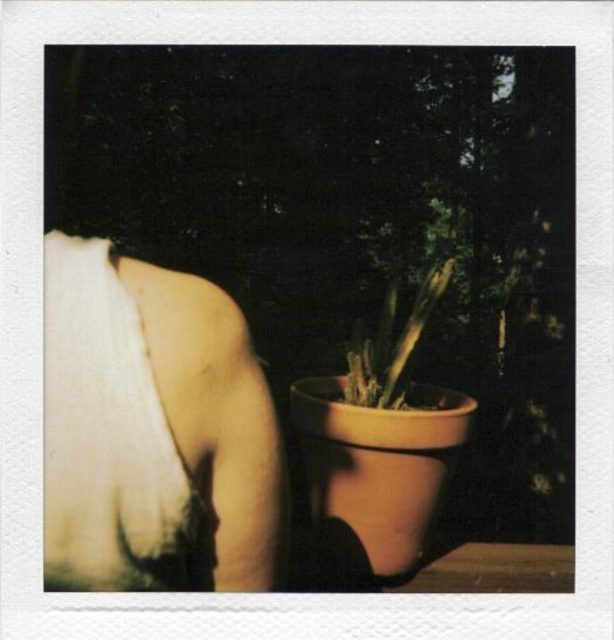
Is white cotton bandage at upper left positioned before matte clay pot at center?

Yes, it is.

Who is positioned more to the right, white cotton bandage at upper left or matte clay pot at center?

matte clay pot at center is more to the right.

Describe the element at coordinates (106, 436) in the screenshot. I see `white cotton bandage at upper left` at that location.

The image size is (614, 640). Find the location of `white cotton bandage at upper left`. white cotton bandage at upper left is located at coordinates (106, 436).